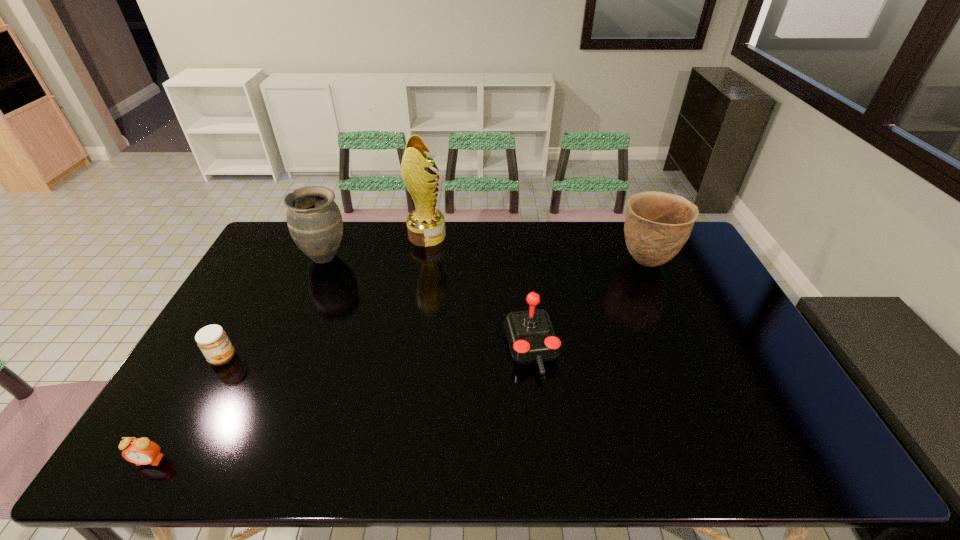
The image size is (960, 540). Identify the location of vacant space located on the front of the pottery. (663, 302).

At what (x,y) coordinates should I click in order to perform the action: click on blank space located on the front of the third shortest object. Please return your answer as a coordinate pair (x, y). Looking at the image, I should click on (540, 430).

Find the location of a particular element. This screenshot has width=960, height=540. vacant space situated 0.050m on the front label of the jam is located at coordinates (253, 358).

Locate an element on the screen. award that is at the far edge is located at coordinates (426, 225).

Where is `urn at the far edge`? urn at the far edge is located at coordinates (314, 220).

This screenshot has height=540, width=960. What are the coordinates of `pottery that is at the far edge` in the screenshot? It's located at (657, 225).

At what (x,y) coordinates should I click in order to perform the action: click on object at the near edge. Please return your answer as a coordinate pair (x, y). The height and width of the screenshot is (540, 960). Looking at the image, I should click on (141, 451).

You are a GUI agent. You are given a task and a screenshot of the screen. Output one action in this format:
    pyautogui.click(x=<x>, y=<y>)
    Task: Click on the urn at the left edge
    The height and width of the screenshot is (540, 960).
    Given the screenshot: What is the action you would take?
    pyautogui.click(x=314, y=220)

Where is `jam present at the left edge`? The height and width of the screenshot is (540, 960). jam present at the left edge is located at coordinates (212, 340).

The height and width of the screenshot is (540, 960). I want to click on alarm clock that is at the left edge, so click(x=141, y=451).